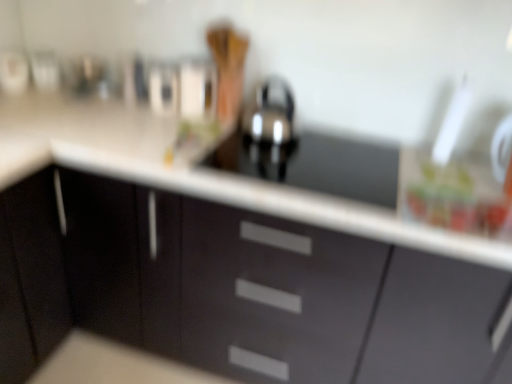
Where is `matte black cabinets at center`? The height and width of the screenshot is (384, 512). matte black cabinets at center is located at coordinates (231, 289).

This screenshot has height=384, width=512. Describe the element at coordinates (231, 289) in the screenshot. I see `matte black cabinets at center` at that location.

Find the location of `black glossy sink at center`. black glossy sink at center is located at coordinates (306, 153).

Measure the distance between point (221,158) and camera.

The distance of point (221,158) from camera is 4.21 feet.

Image resolution: width=512 pixels, height=384 pixels. What do you see at coordinates (306, 153) in the screenshot?
I see `black glossy sink at center` at bounding box center [306, 153].

I want to click on matte black cabinets at center, so click(231, 289).

Between black glossy sink at center and matte black cabinets at center, which one appears on the right side from the viewer's perspective?

Positioned to the right is black glossy sink at center.

Between black glossy sink at center and matte black cabinets at center, which one is positioned behind?

black glossy sink at center is further from the camera.

Is point (287, 174) positioned in front of point (442, 382)?

No, (287, 174) is behind (442, 382).

Consider the image. From the image's perspective, which one is positioned higher, black glossy sink at center or matte black cabinets at center?

black glossy sink at center, from the image's perspective.

From a real-world perspective, between black glossy sink at center and matte black cabinets at center, who is vertically lower?

matte black cabinets at center, from a real-world perspective.

Does black glossy sink at center have a greater width compared to matte black cabinets at center?

No, black glossy sink at center is not wider than matte black cabinets at center.

Can you confirm if black glossy sink at center is shorter than matte black cabinets at center?

Indeed, black glossy sink at center has a lesser height compared to matte black cabinets at center.

Can you confirm if black glossy sink at center is bigger than matte black cabinets at center?

No, black glossy sink at center is not bigger than matte black cabinets at center.

Choose the correct answer: Is black glossy sink at center inside matte black cabinets at center or outside it?

black glossy sink at center fits inside matte black cabinets at center.

Are black glossy sink at center and matte black cabinets at center making contact?

No, black glossy sink at center is not making contact with matte black cabinets at center.

Could you tell me if black glossy sink at center is facing matte black cabinets at center?

Yes, black glossy sink at center is aimed at matte black cabinets at center.

Can you tell me how much black glossy sink at center and matte black cabinets at center differ in facing direction?

The angle between the facing direction of black glossy sink at center and the facing direction of matte black cabinets at center is 0.142 degrees.

Measure the distance from black glossy sink at center to matte black cabinets at center.

black glossy sink at center and matte black cabinets at center are 15.47 inches apart.

Where is `sink behind the matte black cabinets at center`? Image resolution: width=512 pixels, height=384 pixels. sink behind the matte black cabinets at center is located at coordinates (x=306, y=153).

Would you say matte black cabinets at center is to the left or to the right of black glossy sink at center in the picture?

matte black cabinets at center is positioned on black glossy sink at center's left side.

Is the depth of matte black cabinets at center less than that of black glossy sink at center?

Yes.

Which point is more forward, (39, 325) or (388, 154)?

The point (39, 325) is more forward.

From the image's perspective, is matte black cabinets at center below black glossy sink at center?

Yes.

From a real-world perspective, who is located lower, matte black cabinets at center or black glossy sink at center?

matte black cabinets at center, from a real-world perspective.

Considering the relative sizes of matte black cabinets at center and black glossy sink at center in the image provided, is matte black cabinets at center thinner than black glossy sink at center?

No.

Is matte black cabinets at center taller or shorter than black glossy sink at center?

In the image, matte black cabinets at center appears to be taller than black glossy sink at center.

Looking at this image, between matte black cabinets at center and black glossy sink at center, which one has smaller size?

black glossy sink at center is smaller.

Is matte black cabinets at center not inside black glossy sink at center?

Yes.

Is matte black cabinets at center far from black glossy sink at center?

matte black cabinets at center is near black glossy sink at center, not far away.

Is matte black cabinets at center oriented away from black glossy sink at center?

No, matte black cabinets at center's orientation is not away from black glossy sink at center.

How different are the orientations of matte black cabinets at center and black glossy sink at center in degrees?

0.142 degrees separate the facing orientations of matte black cabinets at center and black glossy sink at center.

In the image, there is a black glossy sink at center. At what (x,y) coordinates should I click in order to perform the action: click on cabinetry below it (from the image's perspective). Please return your answer as a coordinate pair (x, y). Looking at the image, I should click on (231, 289).

Image resolution: width=512 pixels, height=384 pixels. I want to click on sink on the right of matte black cabinets at center, so click(306, 153).

Where is `sink that is above the matte black cabinets at center (from a real-world perspective)`? The height and width of the screenshot is (384, 512). sink that is above the matte black cabinets at center (from a real-world perspective) is located at coordinates (306, 153).